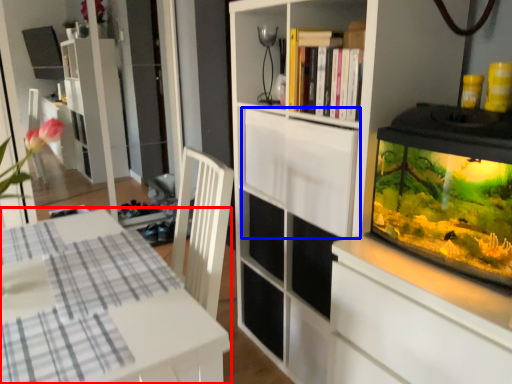
Question: Which of the following is the closest to the observer, table (highlighted by a red box) or cabinetry (highlighted by a blue box)?

Choices:
 (A) table
 (B) cabinetry

Answer: (A)